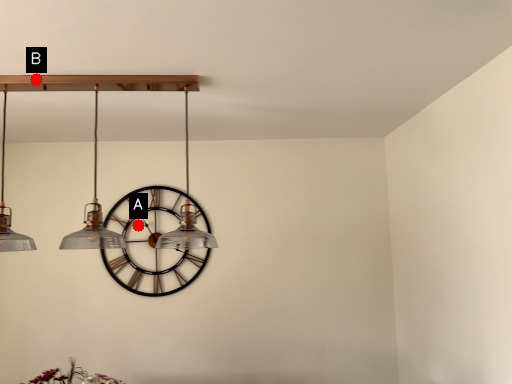
Question: Two points are circled on the image, labeled by A and B beside each circle. Which point is closer to the camera?

Choices:
 (A) A is closer
 (B) B is closer

Answer: (B)